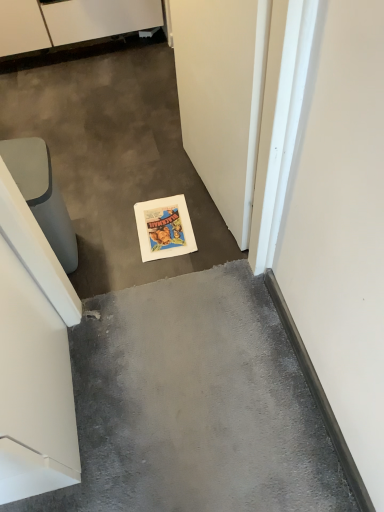
Question: From a real-world perspective, is white glossy cabinet at upper left physically above matte gray trash can at left?

Choices:
 (A) yes
 (B) no

Answer: (B)

Question: Does white glossy cabinet at upper left appear on the right side of matte gray trash can at left?

Choices:
 (A) no
 (B) yes

Answer: (A)

Question: Is the position of white glossy cabinet at upper left more distant than that of matte gray trash can at left?

Choices:
 (A) yes
 (B) no

Answer: (A)

Question: Is white glossy cabinet at upper left turned away from matte gray trash can at left?

Choices:
 (A) yes
 (B) no

Answer: (B)

Question: From the image's perspective, is white glossy cabinet at upper left above matte gray trash can at left?

Choices:
 (A) no
 (B) yes

Answer: (B)

Question: Does white glossy cabinet at upper left have a lesser height compared to matte gray trash can at left?

Choices:
 (A) no
 (B) yes

Answer: (B)

Question: Is matte gray trash can at left facing towards white matte door at lower center?

Choices:
 (A) no
 (B) yes

Answer: (A)

Question: Does matte gray trash can at left appear on the right side of white matte door at lower center?

Choices:
 (A) yes
 (B) no

Answer: (B)

Question: Does matte gray trash can at left have a lesser height compared to white matte door at lower center?

Choices:
 (A) no
 (B) yes

Answer: (B)

Question: Is matte gray trash can at left looking in the opposite direction of white matte door at lower center?

Choices:
 (A) no
 (B) yes

Answer: (A)

Question: Considering the relative positions of matte gray trash can at left and white matte door at lower center in the image provided, is matte gray trash can at left to the left of white matte door at lower center from the viewer's perspective?

Choices:
 (A) yes
 (B) no

Answer: (A)

Question: From the image's perspective, does matte gray trash can at left appear lower than white matte door at lower center?

Choices:
 (A) yes
 (B) no

Answer: (A)

Question: Is white matte door at lower center positioned in front of white glossy cabinet at upper left?

Choices:
 (A) yes
 (B) no

Answer: (A)